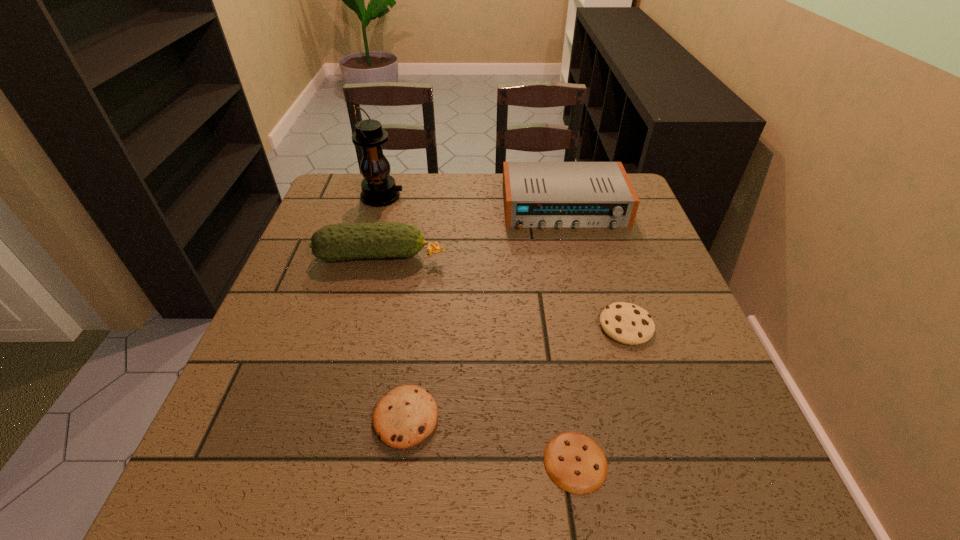
You are a GUI agent. You are given a task and a screenshot of the screen. Output one action in this format:
    pyautogui.click(x=<x>, y=<y>)
    Task: Click on the radio receiver present at the right edge
    
    Given the screenshot: What is the action you would take?
    pyautogui.click(x=536, y=194)

This screenshot has width=960, height=540. I want to click on cookie present at the right edge, so click(x=626, y=323).

Locate an element on the screen. object present at the far left corner is located at coordinates (379, 189).

Image resolution: width=960 pixels, height=540 pixels. I want to click on object at the far right corner, so click(x=536, y=194).

I want to click on vacant region at the far edge, so click(x=467, y=187).

Where is `vacant area at the near edge of the desktop`? The height and width of the screenshot is (540, 960). vacant area at the near edge of the desktop is located at coordinates (481, 491).

Where is `free space at the left edge of the desktop`? free space at the left edge of the desktop is located at coordinates (295, 267).

The image size is (960, 540). In order to click on vacant space at the right edge of the desktop in this screenshot , I will do `click(700, 341)`.

This screenshot has height=540, width=960. In the image, there is a desktop. Find the location of `free space at the far left corner`. free space at the far left corner is located at coordinates (348, 181).

Identify the location of vacant point located between the radio receiver and the fifth tallest object. (485, 313).